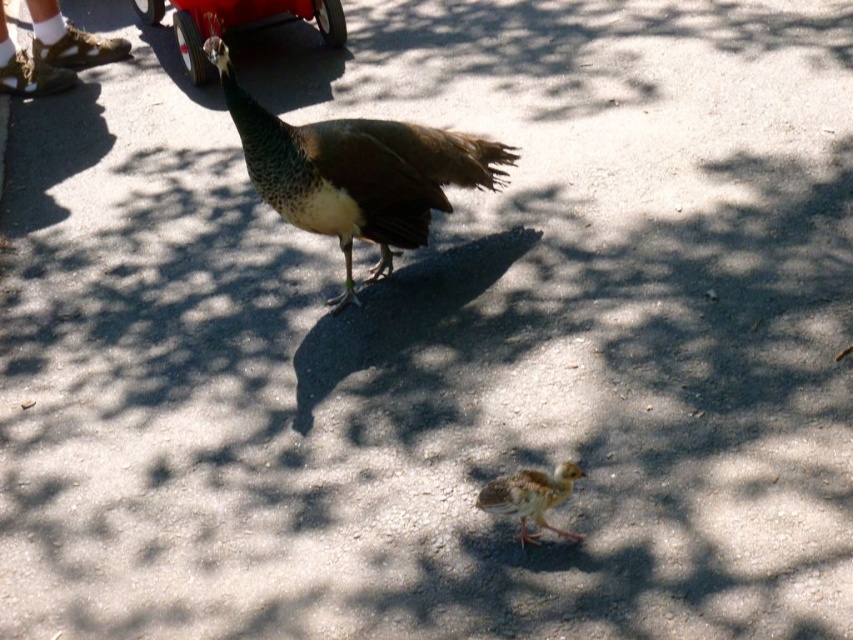
You are standing in front of the peacock and its chick on the paved surface. You see two points marked on the ground. The first point is at position point(190, 49) and the second point is at point(535, 541). Which point is closer to you?

The point at position point(190, 49) is closer to you because it is further to the camera than point(535, 541).

You are a photographer trying to capture both the metallic red car at upper left and the brown speckled chick at lower center in a single frame. Given their sizes, which object should you focus on first to ensure both fit in the photo?

The metallic red car at upper left is bigger than the brown speckled chick at lower center, so you should focus on the metallic red car at upper left first to ensure it fits in the frame, then adjust to include the smaller brown speckled chick at lower center.

You are a photographer trying to capture both the shiny brown peacock at center and the brown speckled chick at lower center in a single shot. Based on their positions, which one would appear closer to the camera in the photo?

The shiny brown peacock at center appears closer to the camera because it is further to the viewer than the brown speckled chick at lower center, meaning it would occupy a more prominent position in the foreground of the photo.